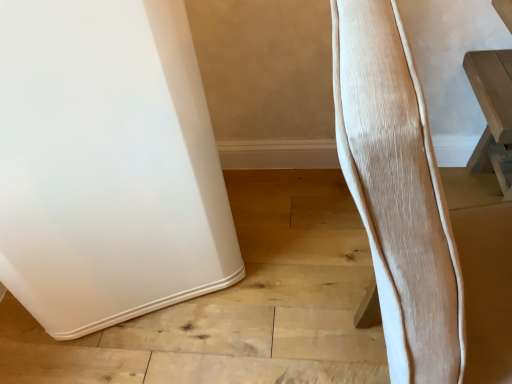
Describe the element at coordinates (397, 192) in the screenshot. This screenshot has height=384, width=512. I see `light brown wood swivel chair at right` at that location.

The image size is (512, 384). What are the coordinates of `light brown wood swivel chair at right` in the screenshot? It's located at (397, 192).

The width and height of the screenshot is (512, 384). What are the coordinates of `light brown wood swivel chair at right` in the screenshot? It's located at (397, 192).